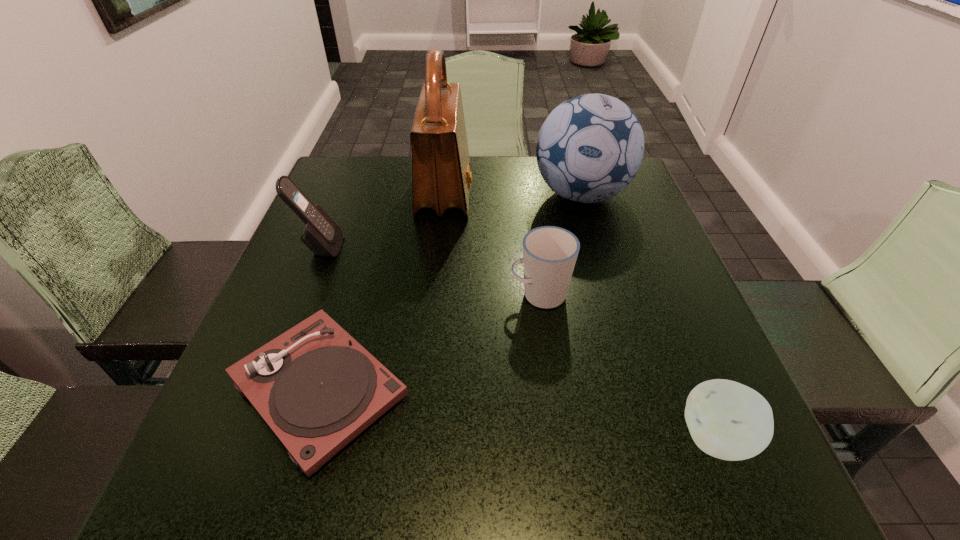
The height and width of the screenshot is (540, 960). In order to click on free point that satisfies the following two spatial constraints: 1. on the front-facing side of the cellular telephone; 2. on the back side of the apple in this screenshot , I will do `click(244, 438)`.